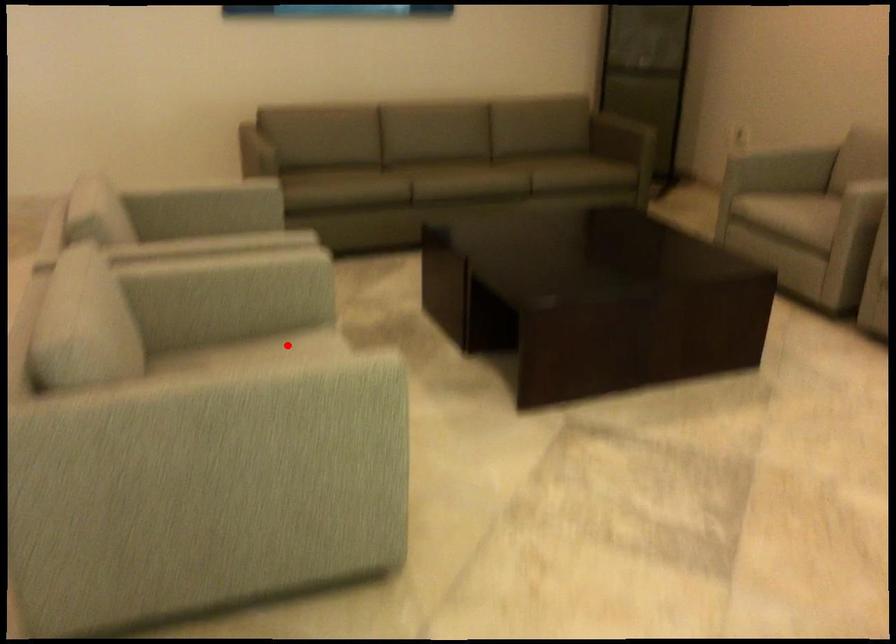
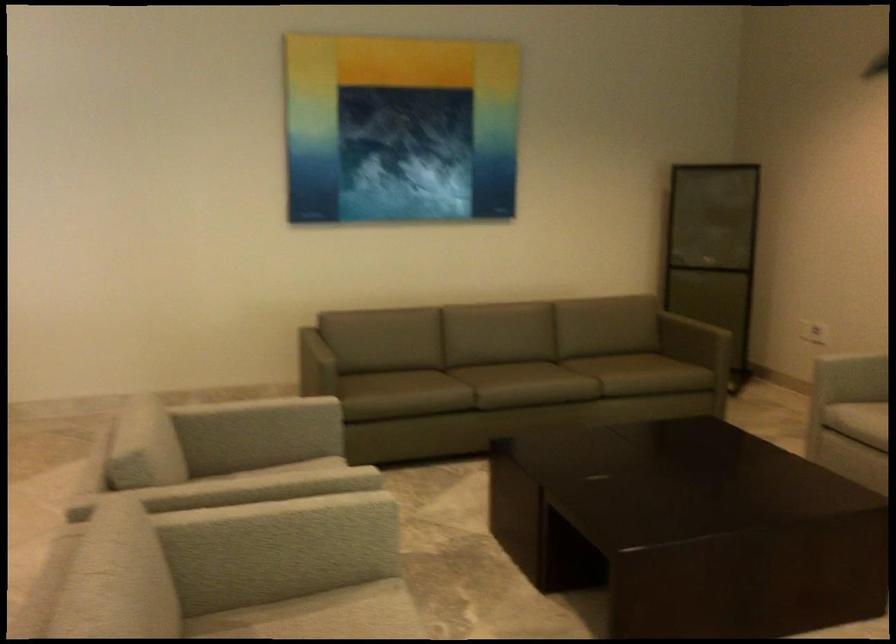
Question: I am providing you with two images of the same scene from different viewpoints. In image1, a red point is highlighted. Considering the same 3D point in image2, which of the following is correct?

Choices:
 (A) It is closer
 (B) It is farther

Answer: (A)